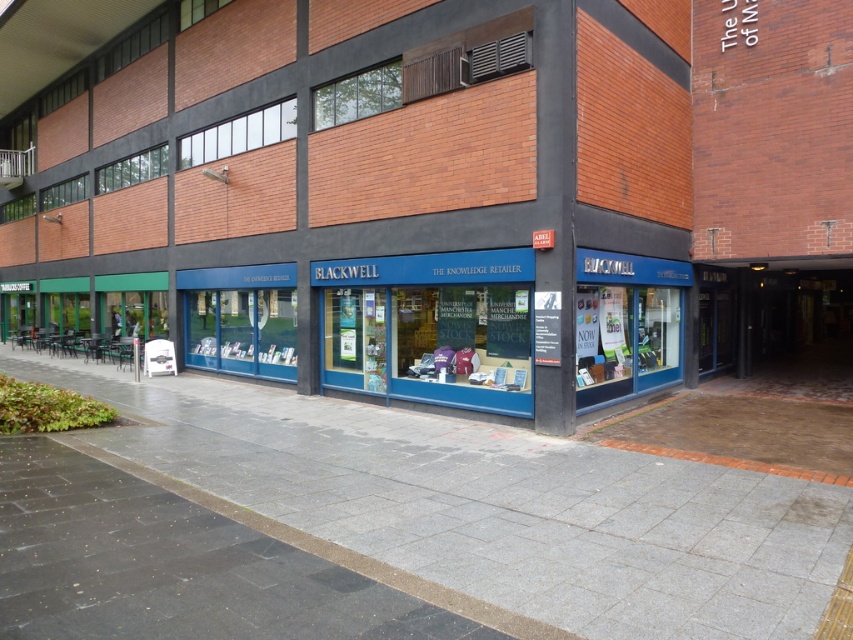
You are a delivery person trying to park your van in front of the blue glass storefront at center. The van requires a parking space that is at least as big as the gray concrete pavement at center. Can you park here?

The blue glass storefront at center is bigger than gray concrete pavement at center, so the parking space here is not large enough for the van which needs at least the size of the gray concrete pavement at center. Please look for a larger space.

You are standing at the point closest to the building in the image. Which of the two points, point (660, 314) or point (461, 484), is farther away from you?

Point (660, 314) is behind point (461, 484), so it is farther away from you.

You are a delivery person with a box that needs to be placed on the gray concrete pavement at center. The box is 5 meters tall. Can you safely place it there without it touching the blue glass storefront at center?

The distance between the blue glass storefront at center and the gray concrete pavement at center is 4.78 meters. Since the box is 5 meters tall, it would extend beyond the available space, so placing it there would cause the box to touch the blue glass storefront at center.